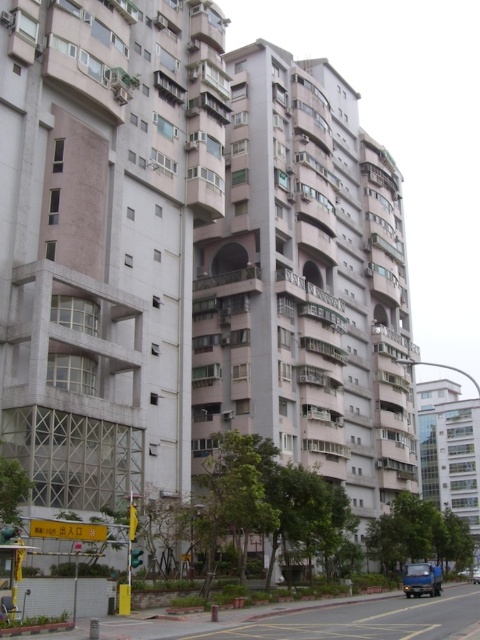
Does blue matte truck at lower right lie behind metallic silver car at center?

That is False.

Does blue matte truck at lower right appear on the right side of metallic silver car at center?

Incorrect, blue matte truck at lower right is not on the right side of metallic silver car at center.

Which is behind, point (422, 570) or point (477, 577)?

Positioned behind is point (477, 577).

Where is `blue matte truck at lower right`? blue matte truck at lower right is located at coordinates (421, 579).